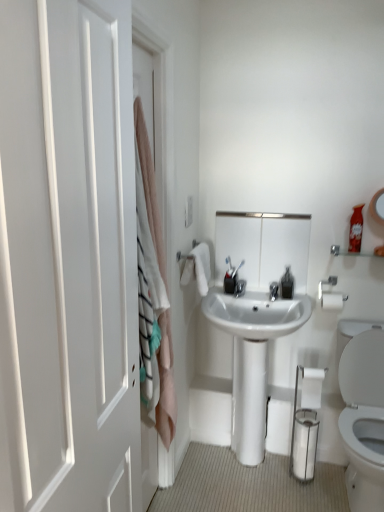
Question: Does white glossy toilet paper at lower right appear on the left side of pink fabric curtain at left?

Choices:
 (A) no
 (B) yes

Answer: (A)

Question: Is white glossy toilet paper at lower right not within pink fabric curtain at left?

Choices:
 (A) no
 (B) yes

Answer: (B)

Question: From the image's perspective, would you say white glossy toilet paper at lower right is positioned over pink fabric curtain at left?

Choices:
 (A) yes
 (B) no

Answer: (B)

Question: Does white glossy toilet paper at lower right have a lesser width compared to pink fabric curtain at left?

Choices:
 (A) yes
 (B) no

Answer: (A)

Question: Does white glossy toilet paper at lower right have a smaller size compared to pink fabric curtain at left?

Choices:
 (A) yes
 (B) no

Answer: (A)

Question: From a real-world perspective, is white glossy toilet paper at lower right positioned over pink fabric curtain at left based on gravity?

Choices:
 (A) no
 (B) yes

Answer: (A)

Question: Considering the relative sizes of white cotton towel at upper center and white glossy toilet paper at lower right in the image provided, is white cotton towel at upper center wider than white glossy toilet paper at lower right?

Choices:
 (A) no
 (B) yes

Answer: (B)

Question: Is white cotton towel at upper center touching white glossy toilet paper at lower right?

Choices:
 (A) yes
 (B) no

Answer: (B)

Question: Is white cotton towel at upper center at the right side of white glossy toilet paper at lower right?

Choices:
 (A) yes
 (B) no

Answer: (B)

Question: From a real-world perspective, does white cotton towel at upper center stand above white glossy toilet paper at lower right?

Choices:
 (A) no
 (B) yes

Answer: (B)

Question: Considering the relative sizes of white cotton towel at upper center and white glossy toilet paper at lower right in the image provided, is white cotton towel at upper center taller than white glossy toilet paper at lower right?

Choices:
 (A) no
 (B) yes

Answer: (B)

Question: Is there a large distance between white cotton towel at upper center and white glossy toilet paper at lower right?

Choices:
 (A) no
 (B) yes

Answer: (A)

Question: Considering the relative sizes of clear plastic soap dispenser at center and white cotton towel at upper center in the image provided, is clear plastic soap dispenser at center wider than white cotton towel at upper center?

Choices:
 (A) yes
 (B) no

Answer: (B)